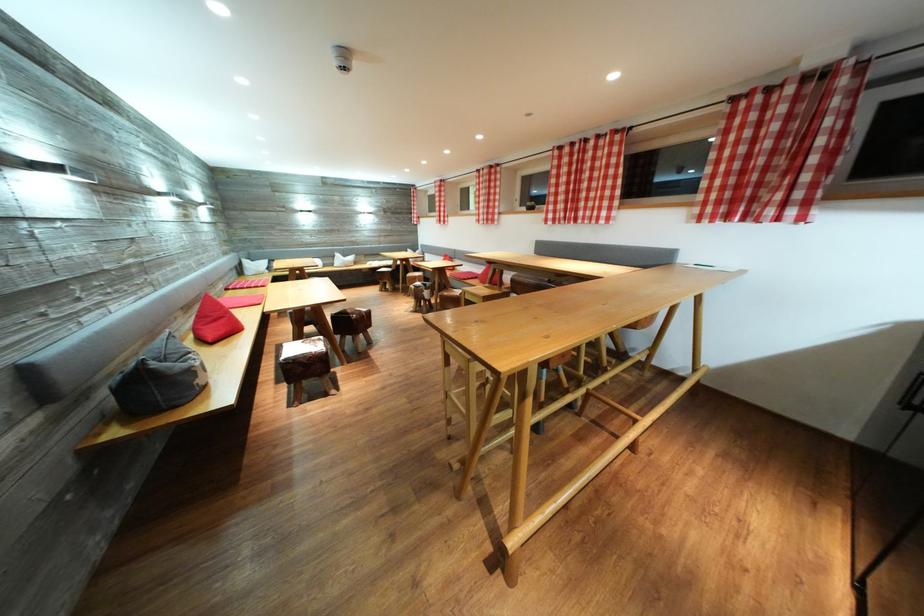
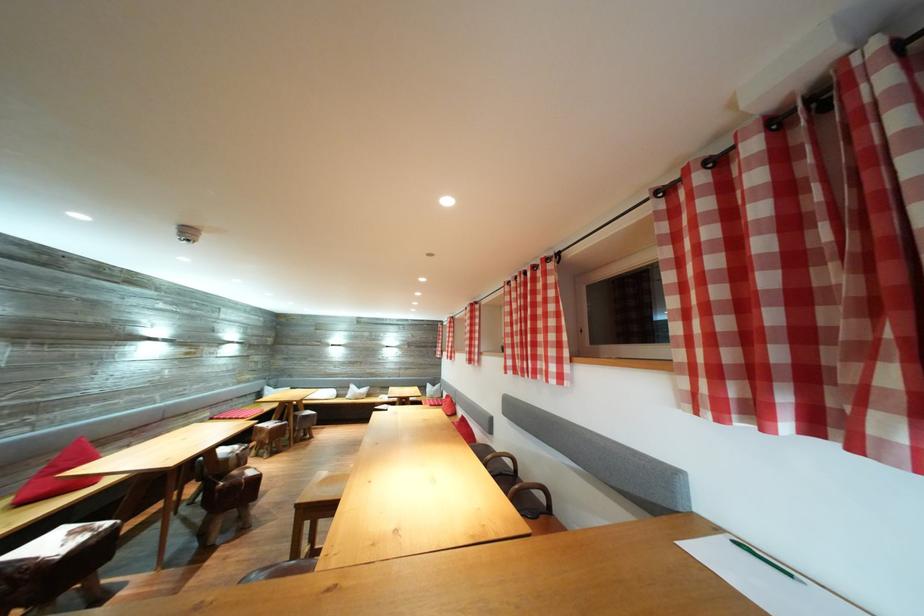
In the second image, find the point that corresponds to pixel 321 346 in the first image.

(91, 536)